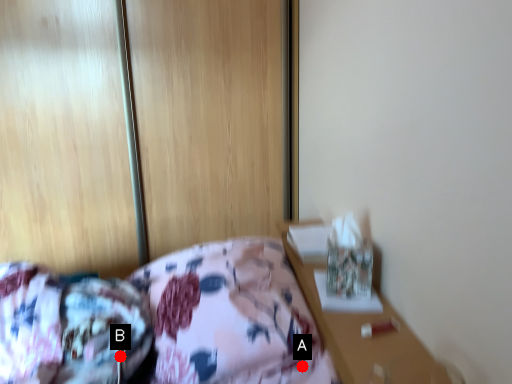
Question: Two points are circled on the image, labeled by A and B beside each circle. Which point is closer to the camera?

Choices:
 (A) A is closer
 (B) B is closer

Answer: (A)